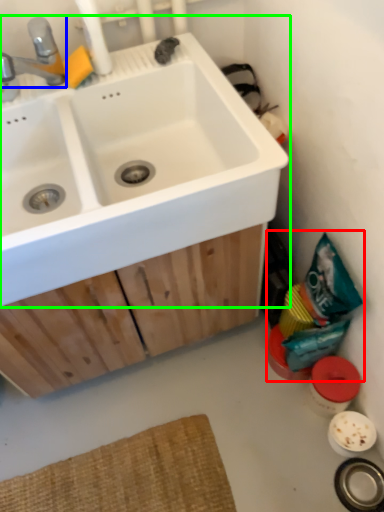
Question: Which is nearer to the garbage (highlighted by a red box)? tap (highlighted by a blue box) or sink (highlighted by a green box).

Choices:
 (A) tap
 (B) sink

Answer: (B)